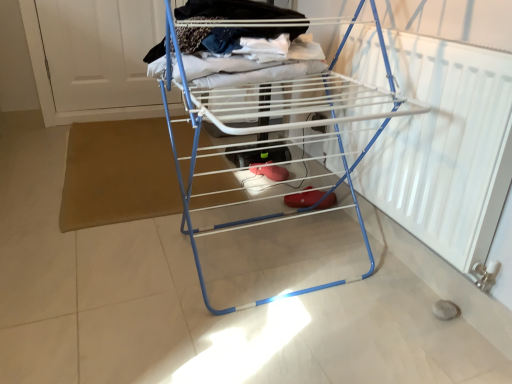
Measure the distance between point (84, 69) and camera.

The depth of point (84, 69) is 9.04 feet.

Locate an element on the screen. This screenshot has width=512, height=384. white matte door at upper left is located at coordinates (100, 51).

Describe the element at coordinates (100, 51) in the screenshot. I see `white matte door at upper left` at that location.

Measure the distance between point (188,215) and camera.

Point (188,215) is 4.86 feet from camera.

Describe the element at coordinates (267, 121) in the screenshot. I see `blue metal drying rack at center` at that location.

This screenshot has width=512, height=384. Find the location of `blue metal drying rack at center`. blue metal drying rack at center is located at coordinates (267, 121).

This screenshot has height=384, width=512. I want to click on white matte door at upper left, so click(100, 51).

Considering the positions of objects white matte door at upper left and blue metal drying rack at center in the image provided, who is more to the left, white matte door at upper left or blue metal drying rack at center?

Positioned to the left is white matte door at upper left.

Is white matte door at upper left in front of or behind blue metal drying rack at center in the image?

In the image, white matte door at upper left appears behind blue metal drying rack at center.

Which is nearer, (x=163, y=17) or (x=306, y=75)?

Point (x=163, y=17).

From the image's perspective, which object appears higher, white matte door at upper left or blue metal drying rack at center?

From the image's view, white matte door at upper left is above.

From a real-world perspective, who is located lower, white matte door at upper left or blue metal drying rack at center?

white matte door at upper left is physically lower.

Consider the image. Considering the sizes of white matte door at upper left and blue metal drying rack at center in the image, is white matte door at upper left wider or thinner than blue metal drying rack at center?

In the image, white matte door at upper left appears to be more narrow than blue metal drying rack at center.

In terms of height, does white matte door at upper left look taller or shorter compared to blue metal drying rack at center?

Considering their sizes, white matte door at upper left has less height than blue metal drying rack at center.

Does white matte door at upper left have a larger size compared to blue metal drying rack at center?

No.

Do you think white matte door at upper left is within blue metal drying rack at center, or outside of it?

white matte door at upper left is spatially situated outside blue metal drying rack at center.

Is white matte door at upper left not close to blue metal drying rack at center?

Indeed, white matte door at upper left is not near blue metal drying rack at center.

Is white matte door at upper left turned away from blue metal drying rack at center?

That's not correct — white matte door at upper left is not looking away from blue metal drying rack at center.

How distant is white matte door at upper left from blue metal drying rack at center?

white matte door at upper left is 1.32 meters from blue metal drying rack at center.

Locate an element on the screen. The width and height of the screenshot is (512, 384). screen door below the blue metal drying rack at center (from a real-world perspective) is located at coordinates (100, 51).

Can you confirm if blue metal drying rack at center is positioned to the left of white matte door at upper left?

In fact, blue metal drying rack at center is to the right of white matte door at upper left.

Is the position of blue metal drying rack at center more distant than that of white matte door at upper left?

That is False.

Does point (374, 130) come behind point (45, 11)?

No, it is in front of (45, 11).

From the image's perspective, is blue metal drying rack at center located beneath white matte door at upper left?

Correct, blue metal drying rack at center appears lower than white matte door at upper left in the image.

From a real-world perspective, is blue metal drying rack at center physically located above or below white matte door at upper left?

From a real-world perspective, blue metal drying rack at center is physically above white matte door at upper left.

Is blue metal drying rack at center wider or thinner than white matte door at upper left?

In the image, blue metal drying rack at center appears to be wider than white matte door at upper left.

Who is taller, blue metal drying rack at center or white matte door at upper left?

blue metal drying rack at center.

Considering the sizes of blue metal drying rack at center and white matte door at upper left in the image, is blue metal drying rack at center bigger or smaller than white matte door at upper left?

In the image, blue metal drying rack at center appears to be larger than white matte door at upper left.

Choose the correct answer: Is blue metal drying rack at center inside white matte door at upper left or outside it?

blue metal drying rack at center is located beyond the bounds of white matte door at upper left.

Is blue metal drying rack at center positioned far away from white matte door at upper left?

That's right, there is a large distance between blue metal drying rack at center and white matte door at upper left.

Could you tell me if blue metal drying rack at center is turned towards white matte door at upper left?

No, blue metal drying rack at center is not turned towards white matte door at upper left.

Can you tell me how much blue metal drying rack at center and white matte door at upper left differ in facing direction?

There is a 91.1-degree angle between the facing directions of blue metal drying rack at center and white matte door at upper left.

Where is `screen door below the blue metal drying rack at center (from a real-world perspective)`? Image resolution: width=512 pixels, height=384 pixels. screen door below the blue metal drying rack at center (from a real-world perspective) is located at coordinates (100, 51).

At what (x,y) coordinates should I click in order to perform the action: click on furniture that is in front of the white matte door at upper left. Please return your answer as a coordinate pair (x, y). This screenshot has width=512, height=384. Looking at the image, I should click on (267, 121).

I want to click on furniture that appears below the white matte door at upper left (from the image's perspective), so click(x=267, y=121).